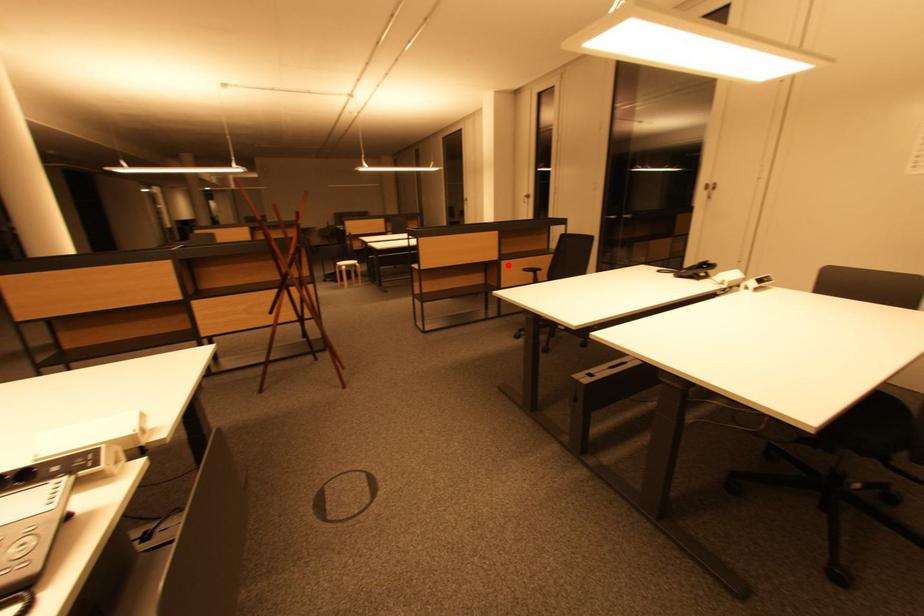
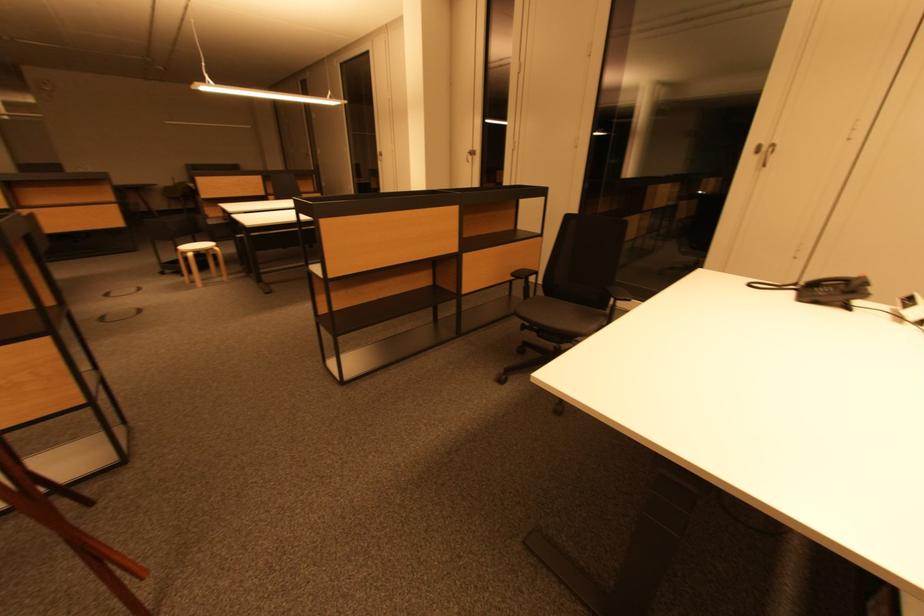
Locate, in the second image, the point that corresponds to the highlighted location in the first image.

(470, 259)